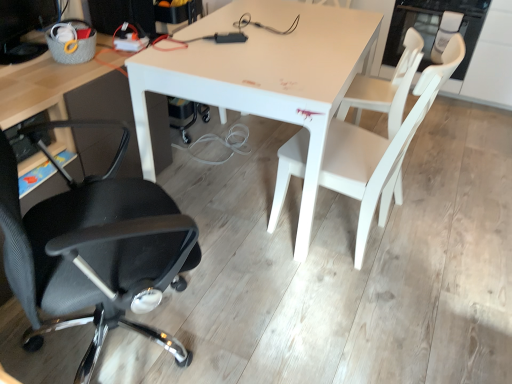
Find the location of a particular element. vacant region in front of white matte table at center is located at coordinates (319, 304).